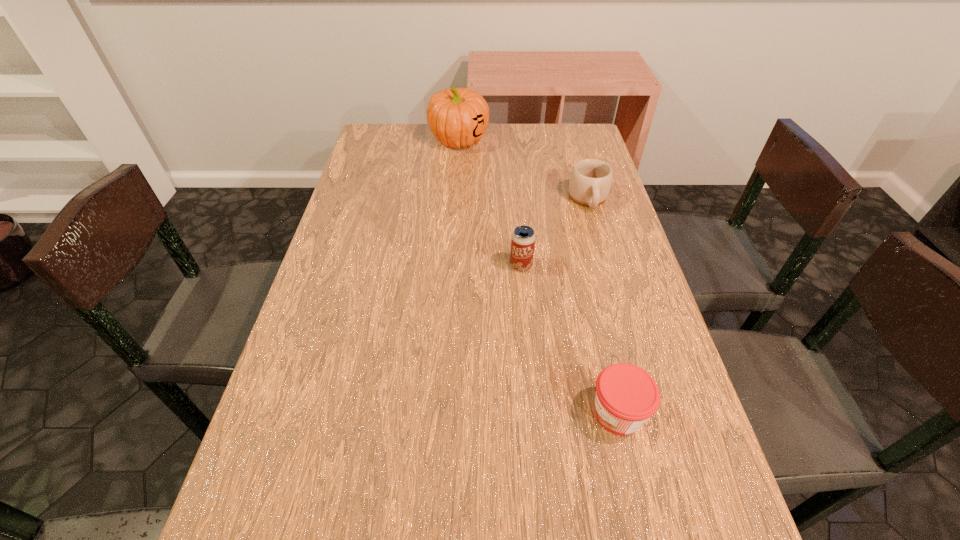
Locate an element on the screen. Image resolution: width=960 pixels, height=540 pixels. vacant point located 0.090m on the label side of the nearest object is located at coordinates (540, 413).

At what (x,y) coordinates should I click in order to perform the action: click on free location located on the label side of the nearest object. Please return your answer as a coordinate pair (x, y). The image size is (960, 540). Looking at the image, I should click on (436, 413).

Find the location of a particular element. object present at the far edge is located at coordinates (457, 117).

Find the location of a particular element. mug at the right edge is located at coordinates (590, 181).

Where is `jam that is at the right edge`? This screenshot has height=540, width=960. jam that is at the right edge is located at coordinates (626, 396).

Where is `blank space at the far edge of the desktop`? The image size is (960, 540). blank space at the far edge of the desktop is located at coordinates (469, 150).

Locate an element on the screen. free space at the left edge is located at coordinates (310, 438).

The width and height of the screenshot is (960, 540). Find the location of `vacant position at the right edge of the desktop`. vacant position at the right edge of the desktop is located at coordinates (644, 305).

You are a GUI agent. You are given a task and a screenshot of the screen. Output one action in this format:
    pyautogui.click(x=<x>, y=<y>)
    Task: Click on the free spot at the far right corner of the desktop
    This screenshot has height=540, width=960.
    Given the screenshot: What is the action you would take?
    pyautogui.click(x=549, y=132)

The width and height of the screenshot is (960, 540). Find the location of `vacant space that is in between the third object from right to left and the mug`. vacant space that is in between the third object from right to left and the mug is located at coordinates coord(555,232).